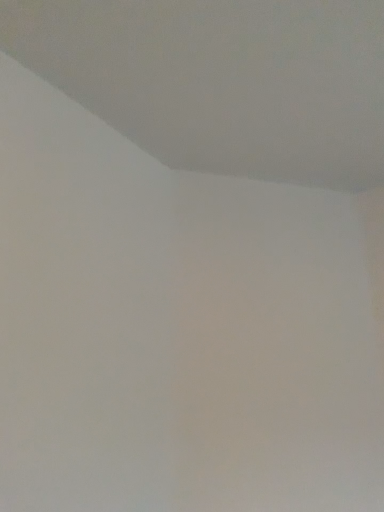
The image size is (384, 512). Identify the location of white matte exhaust hood at upper left. tap(221, 79).

The image size is (384, 512). What do you see at coordinates (221, 79) in the screenshot? I see `white matte exhaust hood at upper left` at bounding box center [221, 79].

What is the approximate height of white matte exhaust hood at upper left?

It is 2.13 inches.

Where is `white matte exhaust hood at upper left`? The width and height of the screenshot is (384, 512). white matte exhaust hood at upper left is located at coordinates (221, 79).